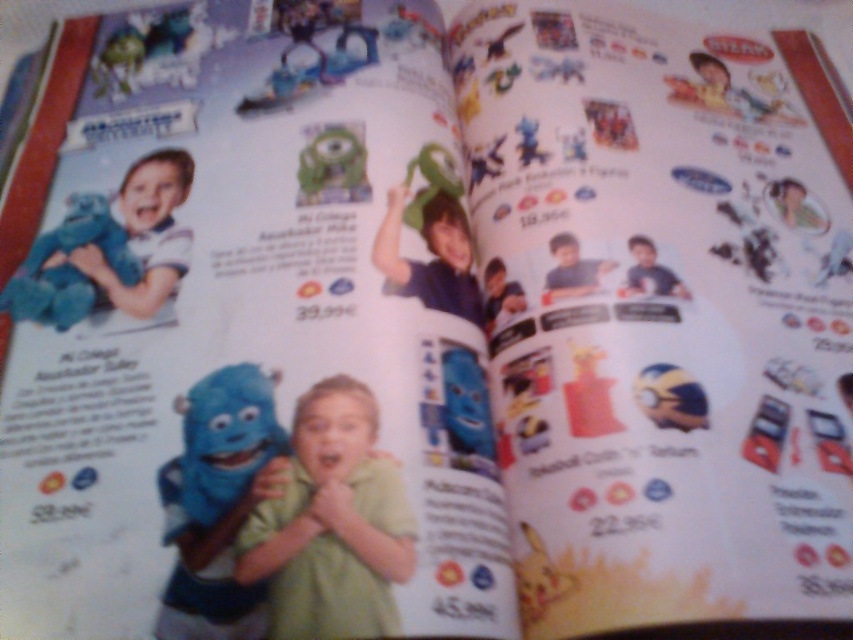
Question: Does green matte plush toy at center come in front of blue plush toy at left?

Choices:
 (A) yes
 (B) no

Answer: (A)

Question: Which point is closer to the camera?

Choices:
 (A) (357, 604)
 (B) (45, 292)
 (C) (183, 625)

Answer: (C)

Question: Can you confirm if green matte plush toy at center is thinner than blue plush toy at left?

Choices:
 (A) yes
 (B) no

Answer: (A)

Question: Which of these objects is positioned farthest from the blue plush toy at left?

Choices:
 (A) green matte plush toy at center
 (B) matte blue plush at center

Answer: (A)

Question: Is matte blue plush at center above blue plush toy at left?

Choices:
 (A) no
 (B) yes

Answer: (A)

Question: Which of the following is the farthest from the observer?

Choices:
 (A) green matte plush toy at center
 (B) blue plush toy at left
 (C) matte blue plush at center

Answer: (B)